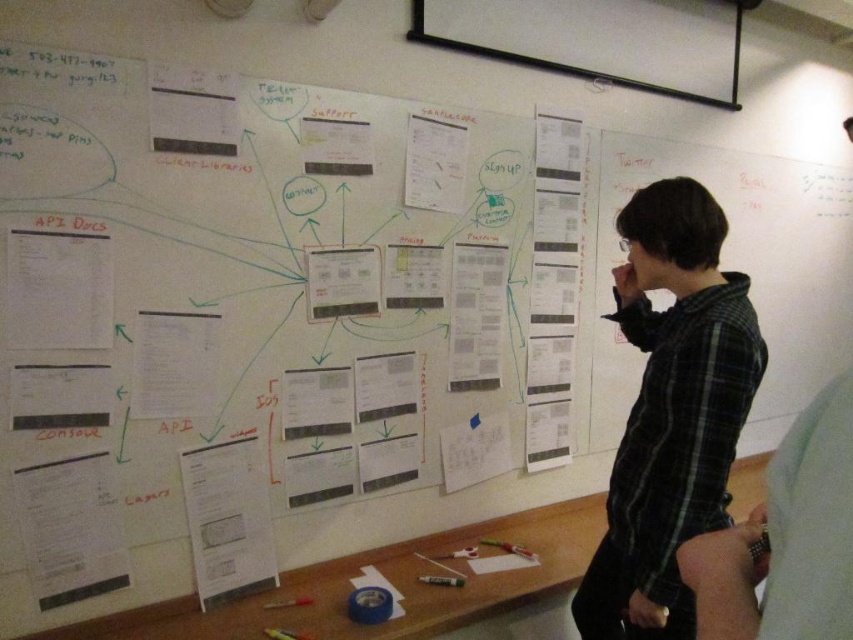
You are a new employee attending a meeting in the workspace shown. You need to present your slides using the white matte projector screen at upper center. However, you notice someone wearing a black plaid shirt at center is standing in front of the screen. Can you see the screen clearly?

The black plaid shirt at center is positioned under the white matte projector screen at upper center, so the person is standing in front of the screen and blocking your view. You cannot see the screen clearly until they move aside.

You are standing in front of the whiteboard and see the point marked at coordinates (671, 412). Which object is located at that point?

The point at coordinates (671, 412) corresponds to the black plaid shirt at center.